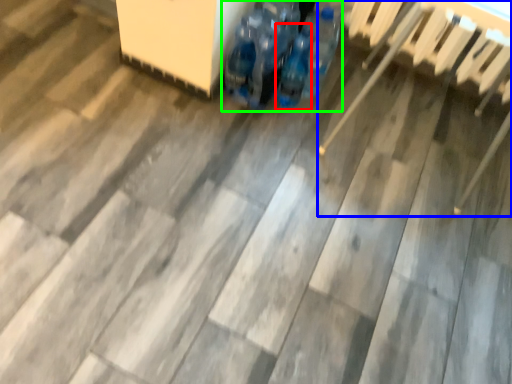
Question: Which is nearer to the bottle (highlighted by a red box)? chair (highlighted by a blue box) or footwear (highlighted by a green box).

Choices:
 (A) chair
 (B) footwear

Answer: (B)